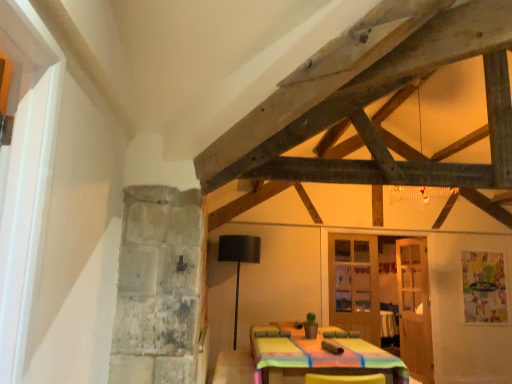
Question: Which direction should I rotate to look at matte glass door at center, which is the 2th door from back to front, — up or down?

Choices:
 (A) up
 (B) down

Answer: (B)

Question: Considering the relative sizes of black matte lamp at center and wooden glass door at center, acting as the 1th door starting from the front, in the image provided, is black matte lamp at center shorter than wooden glass door at center, acting as the 1th door starting from the front,?

Choices:
 (A) yes
 (B) no

Answer: (A)

Question: Is black matte lamp at center turned away from wooden glass door at center, acting as the 1th door starting from the front?

Choices:
 (A) no
 (B) yes

Answer: (A)

Question: Can you confirm if black matte lamp at center is bigger than wooden glass door at center, acting as the 1th door starting from the front?

Choices:
 (A) yes
 (B) no

Answer: (A)

Question: From the image's perspective, is black matte lamp at center located beneath wooden glass door at center, the third door in the back-to-front sequence?

Choices:
 (A) yes
 (B) no

Answer: (B)

Question: Does black matte lamp at center turn towards wooden glass door at center, the third door in the back-to-front sequence?

Choices:
 (A) no
 (B) yes

Answer: (B)

Question: From a real-world perspective, is black matte lamp at center located beneath wooden glass door at center, acting as the 1th door starting from the front?

Choices:
 (A) no
 (B) yes

Answer: (B)

Question: From a real-world perspective, does black matte lamp at center sit lower than matte glass door at center, which is the 2th door from back to front?

Choices:
 (A) no
 (B) yes

Answer: (B)

Question: Is the surface of black matte lamp at center in direct contact with matte glass door at center, the 2th door positioned from the front?

Choices:
 (A) yes
 (B) no

Answer: (B)

Question: Considering the relative sizes of black matte lamp at center and matte glass door at center, which is the 2th door from back to front, in the image provided, is black matte lamp at center shorter than matte glass door at center, which is the 2th door from back to front,?

Choices:
 (A) no
 (B) yes

Answer: (A)

Question: From the image's perspective, would you say black matte lamp at center is positioned over matte glass door at center, the 2th door positioned from the front?

Choices:
 (A) yes
 (B) no

Answer: (B)

Question: Is black matte lamp at center closer to camera compared to matte glass door at center, the 2th door positioned from the front?

Choices:
 (A) yes
 (B) no

Answer: (A)

Question: Does black matte lamp at center have a larger size compared to matte glass door at center, the 2th door positioned from the front?

Choices:
 (A) no
 (B) yes

Answer: (B)

Question: Is matte glass door at center, the 2th door positioned from the front, facing towards wooden door at right, acting as the first door starting from the back?

Choices:
 (A) yes
 (B) no

Answer: (B)